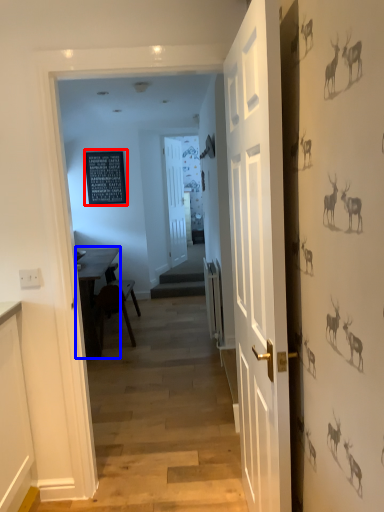
Question: Which object appears closest to the camera in this image, bulletin board (highlighted by a red box) or table (highlighted by a blue box)?

Choices:
 (A) bulletin board
 (B) table

Answer: (B)